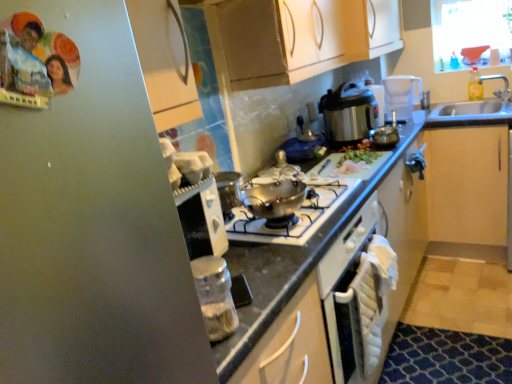
Question: Does stainless steel pressure cooker at upper right, which is the second kitchen appliance from front to back, have a greater height compared to clear plastic bottle at upper right?

Choices:
 (A) no
 (B) yes

Answer: (B)

Question: Can you confirm if stainless steel pressure cooker at upper right, which is the second kitchen appliance from front to back, is positioned to the left of clear plastic bottle at upper right?

Choices:
 (A) no
 (B) yes

Answer: (B)

Question: Considering the relative sizes of stainless steel pressure cooker at upper right, which is the 1th kitchen appliance in right-to-left order, and clear plastic bottle at upper right in the image provided, is stainless steel pressure cooker at upper right, which is the 1th kitchen appliance in right-to-left order, shorter than clear plastic bottle at upper right?

Choices:
 (A) no
 (B) yes

Answer: (A)

Question: Is stainless steel pressure cooker at upper right, which is the 1th kitchen appliance in right-to-left order, closer to the viewer compared to clear plastic bottle at upper right?

Choices:
 (A) no
 (B) yes

Answer: (B)

Question: Is stainless steel pressure cooker at upper right, the 2th kitchen appliance ordered from the bottom, smaller than clear plastic bottle at upper right?

Choices:
 (A) no
 (B) yes

Answer: (A)

Question: Looking at their shapes, would you say stainless steel pressure cooker at upper right, marked as the first kitchen appliance in a top-to-bottom arrangement, is wider or thinner than light wood cabinet at right?

Choices:
 (A) thin
 (B) wide

Answer: (A)

Question: Would you say stainless steel pressure cooker at upper right, the 1th kitchen appliance from the back, is inside or outside light wood cabinet at right?

Choices:
 (A) inside
 (B) outside

Answer: (B)

Question: Does point (347, 82) appear closer or farther from the camera than point (482, 231)?

Choices:
 (A) closer
 (B) farther

Answer: (A)

Question: Is stainless steel pressure cooker at upper right, which is the second kitchen appliance from front to back, in front of or behind light wood cabinet at right in the image?

Choices:
 (A) behind
 (B) front

Answer: (B)

Question: Considering the positions of clear plastic bottle at upper right and light wood cabinet at right in the image, is clear plastic bottle at upper right taller or shorter than light wood cabinet at right?

Choices:
 (A) tall
 (B) short

Answer: (B)

Question: Is point (475, 91) closer or farther from the camera than point (501, 175)?

Choices:
 (A) closer
 (B) farther

Answer: (B)

Question: Is clear plastic bottle at upper right bigger or smaller than light wood cabinet at right?

Choices:
 (A) big
 (B) small

Answer: (B)

Question: From a real-world perspective, is clear plastic bottle at upper right above or below light wood cabinet at right?

Choices:
 (A) above
 (B) below

Answer: (A)

Question: From a real-world perspective, is stainless steel pressure cooker at upper right, the 2th kitchen appliance ordered from the bottom, physically located above or below black granite countertop at center?

Choices:
 (A) below
 (B) above

Answer: (B)

Question: Is stainless steel pressure cooker at upper right, which ranks as the second kitchen appliance in left-to-right order, wider or thinner than black granite countertop at center?

Choices:
 (A) thin
 (B) wide

Answer: (A)